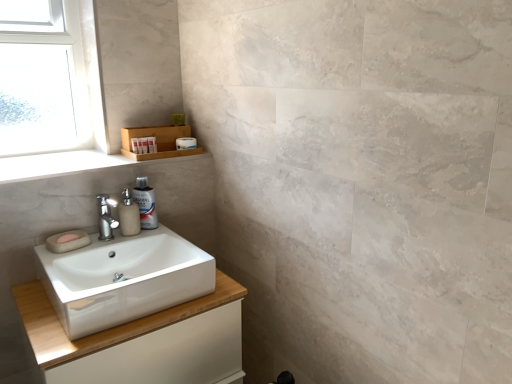
Locate an element on the screen. vacant space to the right of white matte tube at upper left, which appears as the 1th toiletry when viewed from the right is located at coordinates (175, 155).